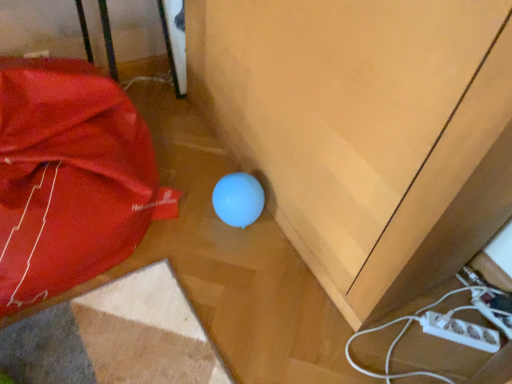
Find the location of a particular element. free space between matte wood cabinet at center and matte red umbrella at lower left is located at coordinates (185, 259).